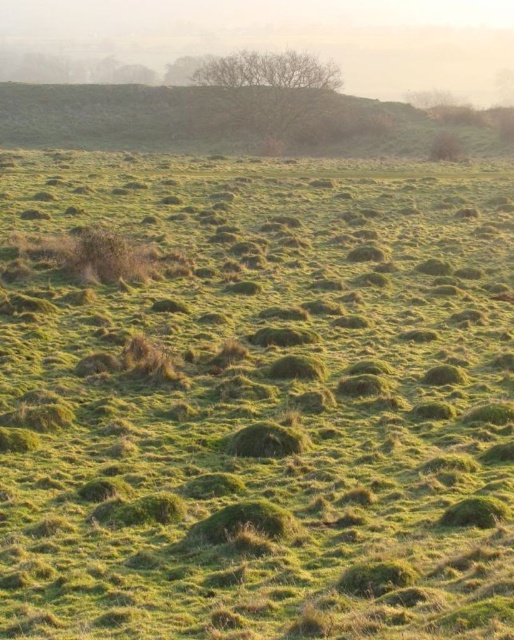
Question: Is foggy mist at upper center above green grassy hillside at upper center?

Choices:
 (A) yes
 (B) no

Answer: (A)

Question: Is foggy mist at upper center to the right of green grassy hillside at upper center from the viewer's perspective?

Choices:
 (A) yes
 (B) no

Answer: (B)

Question: Which point appears closest to the camera in this image?

Choices:
 (A) (107, 136)
 (B) (182, 40)

Answer: (A)

Question: Does foggy mist at upper center appear on the left side of green grassy hillside at upper center?

Choices:
 (A) no
 (B) yes

Answer: (B)

Question: Which point appears closest to the camera in this image?

Choices:
 (A) (159, 147)
 (B) (150, 3)

Answer: (A)